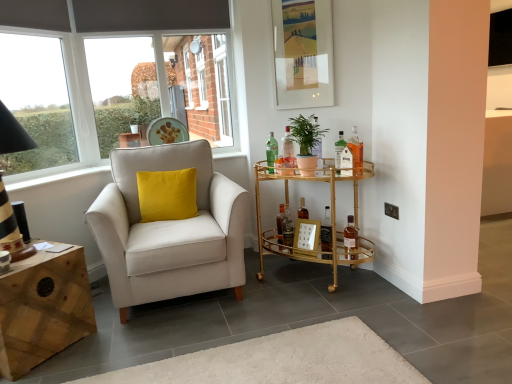
Question: Looking at their shapes, would you say transparent glass window at upper left is wider or thinner than green glass bottle at center, arranged as the 8th bottle when viewed from the right?

Choices:
 (A) thin
 (B) wide

Answer: (A)

Question: Considering the positions of point (60, 157) and point (268, 160), is point (60, 157) closer or farther from the camera than point (268, 160)?

Choices:
 (A) farther
 (B) closer

Answer: (A)

Question: Which of these objects is positioned closest to the clear glass bottle at center, which ranks as the fourth bottle in left-to-right order?

Choices:
 (A) gold mirrored bar cart at center right
 (B) white glass bottle at center, positioned as the 6th bottle in left-to-right order
 (C) matte white armchair at left
 (D) green glass bottle at center, arranged as the 8th bottle when viewed from the right
 (E) black plastic power outlet at upper right

Answer: (D)

Question: Estimate the real-world distances between objects in this image. Which object is farther from the green matte plant at center?

Choices:
 (A) green glass bottle at center, arranged as the 8th bottle when viewed from the right
 (B) clear glass bottle at center, which ranks as the fourth bottle in left-to-right order
 (C) black plastic power outlet at upper right
 (D) matte glass picture frame at upper center
 (E) natural wood desk at lower left

Answer: (E)